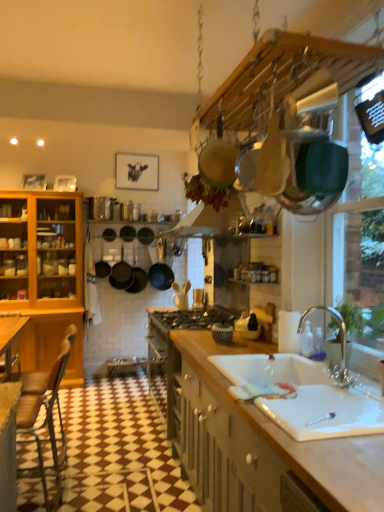
Question: Considering the relative positions of brown leather chair at lower left and chrome metallic faucet at sink right in the image provided, is brown leather chair at lower left to the left of chrome metallic faucet at sink right from the viewer's perspective?

Choices:
 (A) no
 (B) yes

Answer: (B)

Question: Is brown leather chair at lower left outside chrome metallic faucet at sink right?

Choices:
 (A) yes
 (B) no

Answer: (A)

Question: Does brown leather chair at lower left lie in front of chrome metallic faucet at sink right?

Choices:
 (A) yes
 (B) no

Answer: (B)

Question: From a real-world perspective, is brown leather chair at lower left located beneath chrome metallic faucet at sink right?

Choices:
 (A) no
 (B) yes

Answer: (B)

Question: From a real-world perspective, does brown leather chair at lower left stand above chrome metallic faucet at sink right?

Choices:
 (A) no
 (B) yes

Answer: (A)

Question: Is point (339, 332) positioned closer to the camera than point (46, 472)?

Choices:
 (A) closer
 (B) farther

Answer: (A)

Question: Considering the positions of chrome metallic faucet at sink right and brown leather chair at lower left in the image, is chrome metallic faucet at sink right bigger or smaller than brown leather chair at lower left?

Choices:
 (A) big
 (B) small

Answer: (B)

Question: In the image, is chrome metallic faucet at sink right positioned in front of or behind brown leather chair at lower left?

Choices:
 (A) front
 (B) behind

Answer: (A)

Question: From the image's perspective, relative to brown leather chair at lower left, is chrome metallic faucet at sink right above or below?

Choices:
 (A) below
 (B) above

Answer: (B)

Question: Relative to chrome metallic faucet at sink right, is brown leather chair at lower left in front or behind?

Choices:
 (A) front
 (B) behind

Answer: (B)

Question: Is point (44, 471) closer or farther from the camera than point (342, 352)?

Choices:
 (A) farther
 (B) closer

Answer: (A)

Question: Considering the positions of brown leather chair at lower left and chrome metallic faucet at sink right in the image, is brown leather chair at lower left bigger or smaller than chrome metallic faucet at sink right?

Choices:
 (A) small
 (B) big

Answer: (B)

Question: From a real-world perspective, is brown leather chair at lower left positioned above or below chrome metallic faucet at sink right?

Choices:
 (A) above
 (B) below

Answer: (B)

Question: Which is correct: chrome metallic faucet at sink right is inside white wood countertop at lower right, or outside of it?

Choices:
 (A) outside
 (B) inside

Answer: (A)

Question: In the image, is chrome metallic faucet at sink right on the left side or the right side of white wood countertop at lower right?

Choices:
 (A) left
 (B) right

Answer: (B)